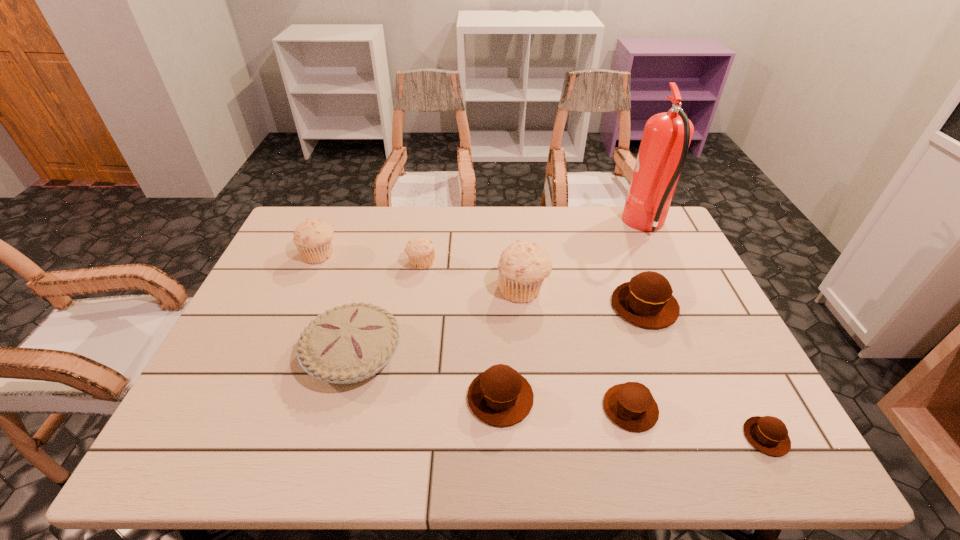
At what (x,y) coordinates should I click in order to perform the action: click on the second biggest brown muffin. Please return your answer as a coordinate pair (x, y). Image resolution: width=960 pixels, height=540 pixels. Looking at the image, I should click on (500, 396).

Identify the location of the eighth tallest object. Image resolution: width=960 pixels, height=540 pixels. (631, 406).

Find the location of a particular element. This screenshot has width=960, height=540. the third biggest brown muffin is located at coordinates (631, 406).

Locate an element on the screen. the smallest brown muffin is located at coordinates coord(768,434).

Locate an element on the screen. This screenshot has height=540, width=960. the rightmost muffin is located at coordinates (768, 434).

Locate an element on the screen. The width and height of the screenshot is (960, 540). vacant point located 0.100m towards the nozzle of the fire extinguisher is located at coordinates (595, 227).

The width and height of the screenshot is (960, 540). In order to click on blank area located towards the nozzle of the fire extinguisher in this screenshot , I will do `click(518, 227)`.

You are a GUI agent. You are given a task and a screenshot of the screen. Output one action in this format:
    pyautogui.click(x=<x>, y=<y>)
    Task: Click on the vacant space located 0.280m towards the nozzle of the fire extinguisher
    
    Given the screenshot: What is the action you would take?
    pyautogui.click(x=542, y=227)

Where is `vacant region located on the left of the biggest beige muffin`? This screenshot has width=960, height=540. vacant region located on the left of the biggest beige muffin is located at coordinates (406, 289).

The width and height of the screenshot is (960, 540). In order to click on free space located on the front of the leftmost muffin in this screenshot , I will do `click(296, 309)`.